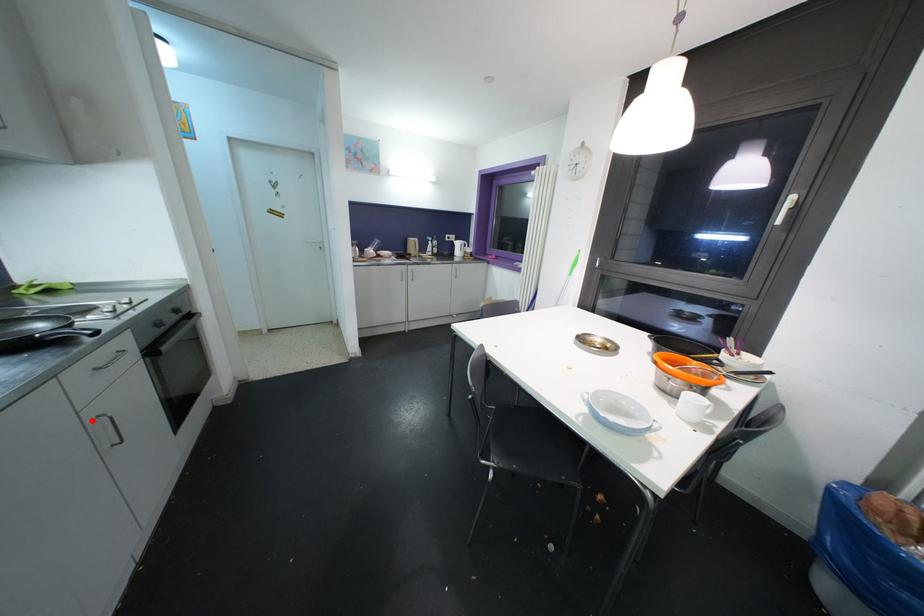
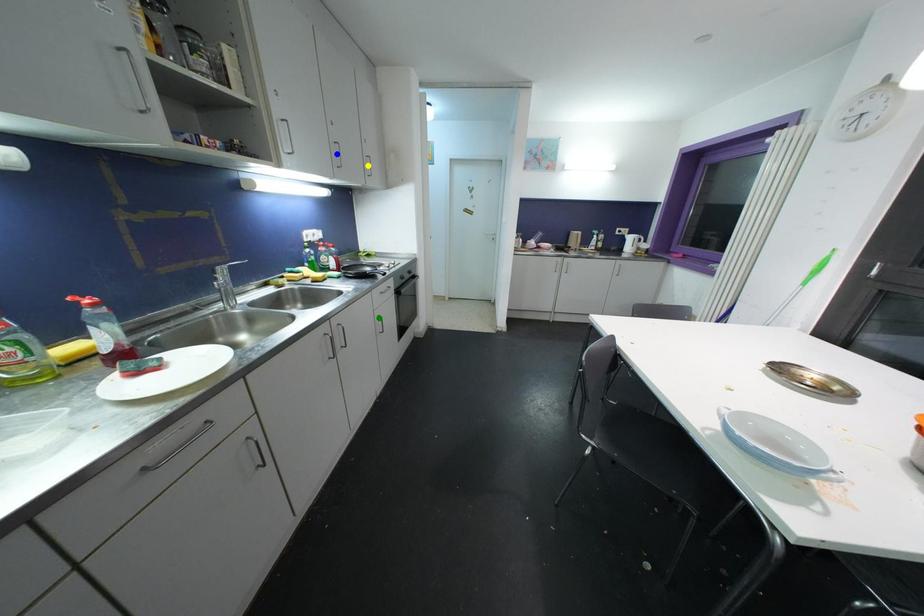
Question: I am providing you with two images of the same scene from different viewpoints. A red point is marked on the first image. You are given multiple points on the second image. Which spot in image 2 lines up with the point in image 1?

Choices:
 (A) green point
 (B) blue point
 (C) yellow point

Answer: (A)